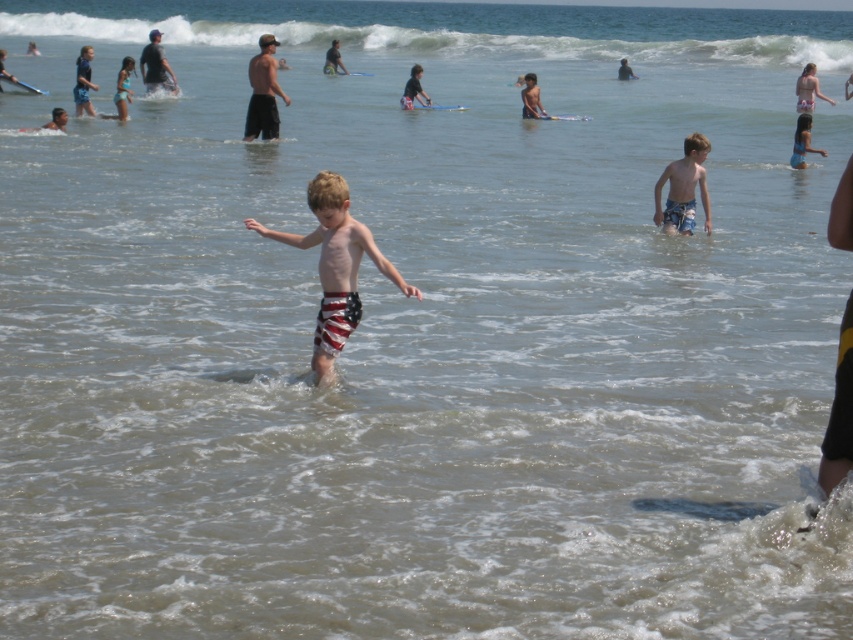
You are a photographer trying to capture the boy in blue striped shorts at center and the man in blue swim trunks at upper center. Which subject is closer to the camera based on their positions?

The blue striped shorts at center is positioned under blue swim trunks at upper center, meaning the blue striped shorts at center is closer to the camera.

You are a photographer trying to capture the american flag swim trunks at center and the matte black surfboard at upper center in the same frame. Based on their positions, which object is closer to the camera?

The american flag swim trunks at center is positioned under the matte black surfboard at upper center, so the surfboard is further away from the camera, making the swim trunks closer.